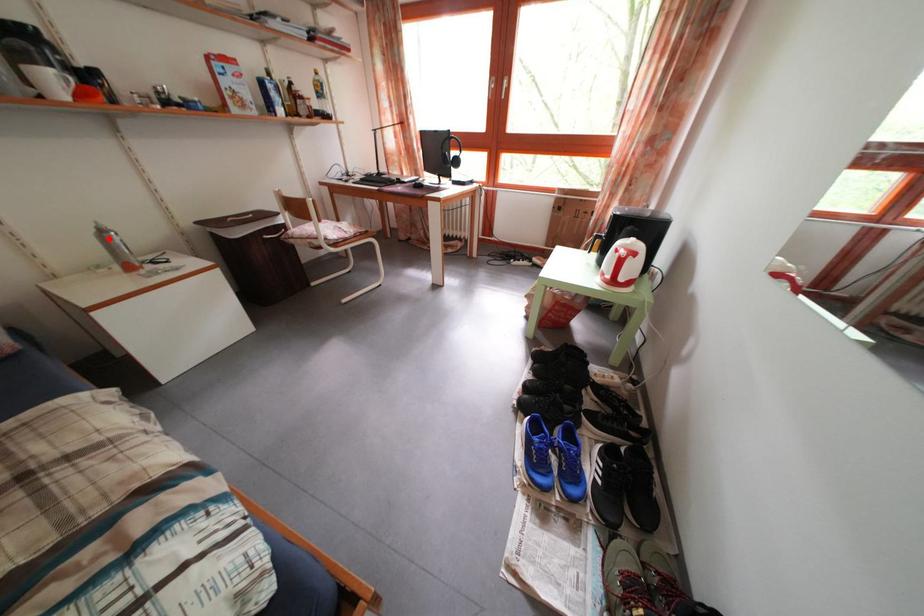
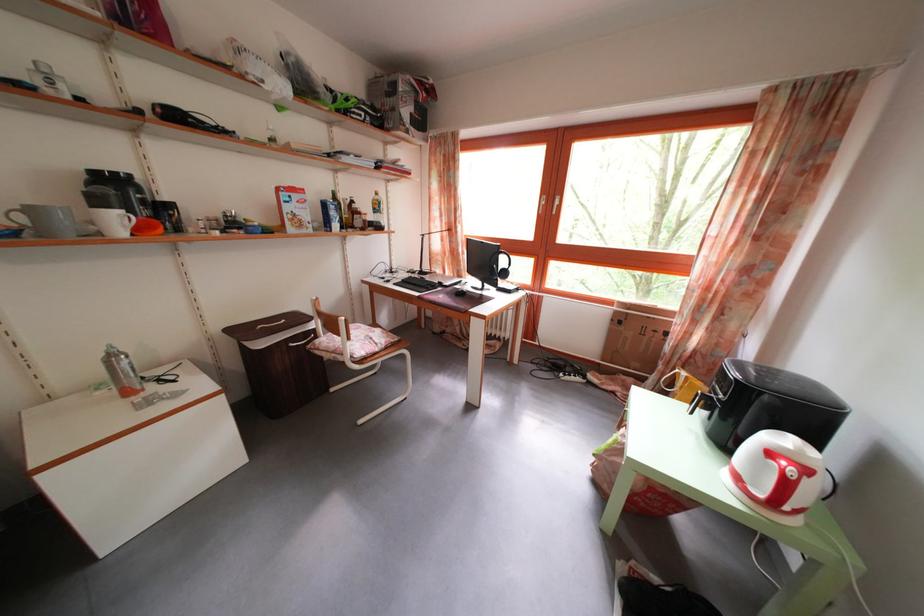
Question: I am providing you with two images of the same scene from different viewpoints. A red point is shown in image1. For the corresponding object point in image2, is it positioned nearer or farther from the camera?

Choices:
 (A) Nearer
 (B) Farther

Answer: (A)